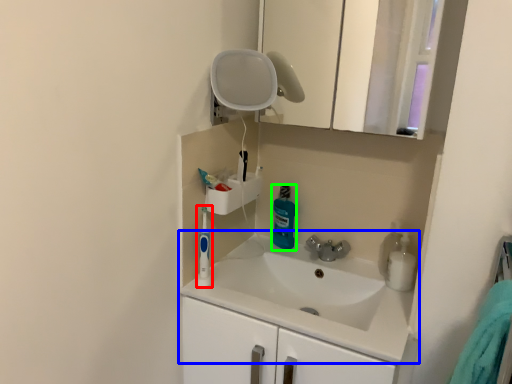
Question: Which is nearer to the toiletry (highlighted by a red box)? sink (highlighted by a blue box) or cleaning product (highlighted by a green box).

Choices:
 (A) sink
 (B) cleaning product

Answer: (A)